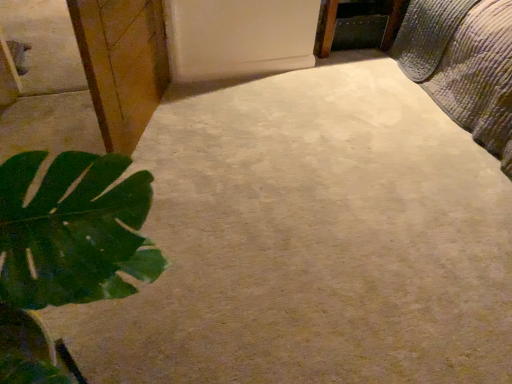
The width and height of the screenshot is (512, 384). I want to click on wooden cabinet at left, so click(122, 64).

What do you see at coordinates (464, 65) in the screenshot?
I see `textured quilted bed at upper right` at bounding box center [464, 65].

The width and height of the screenshot is (512, 384). I want to click on wooden frame at upper right, so click(x=359, y=15).

Between point (437, 64) and point (104, 1), which one is positioned behind?

The point (437, 64) is behind.

Is textured quilted bed at upper right taller or shorter than wooden cabinet at left?

textured quilted bed at upper right is shorter than wooden cabinet at left.

From the image's perspective, which one is positioned higher, textured quilted bed at upper right or wooden cabinet at left?

From the image's view, textured quilted bed at upper right is above.

How much distance is there between textured quilted bed at upper right and wooden cabinet at left?

They are 1.53 meters apart.

Where is `cabinetry in front of the wooden frame at upper right`? This screenshot has width=512, height=384. cabinetry in front of the wooden frame at upper right is located at coordinates (122, 64).

Which object is further away from the camera, wooden cabinet at left or wooden frame at upper right?

wooden frame at upper right is further away from the camera.

What's the angular difference between wooden cabinet at left and wooden frame at upper right's facing directions?

The angular difference between wooden cabinet at left and wooden frame at upper right is 70.3 degrees.

Relative to textured quilted bed at upper right, is wooden frame at upper right in front or behind?

wooden frame at upper right is positioned farther from the viewer than textured quilted bed at upper right.

Is point (377, 6) behind point (468, 10)?

That is True.

Can you confirm if wooden frame at upper right is shorter than textured quilted bed at upper right?

Correct, wooden frame at upper right is not as tall as textured quilted bed at upper right.

Considering the relative sizes of wooden cabinet at left and textured quilted bed at upper right in the image provided, is wooden cabinet at left thinner than textured quilted bed at upper right?

Correct, the width of wooden cabinet at left is less than that of textured quilted bed at upper right.

Is wooden cabinet at left bigger than textured quilted bed at upper right?

Incorrect, wooden cabinet at left is not larger than textured quilted bed at upper right.

Is wooden cabinet at left far from textured quilted bed at upper right?

Absolutely, wooden cabinet at left is distant from textured quilted bed at upper right.

In the image, is wooden cabinet at left positioned in front of or behind textured quilted bed at upper right?

Clearly, wooden cabinet at left is in front of textured quilted bed at upper right.

Visually, is textured quilted bed at upper right positioned to the left or to the right of wooden frame at upper right?

From the image, it's evident that textured quilted bed at upper right is to the right of wooden frame at upper right.

Considering the relative sizes of textured quilted bed at upper right and wooden frame at upper right in the image provided, is textured quilted bed at upper right smaller than wooden frame at upper right?

Incorrect, textured quilted bed at upper right is not smaller in size than wooden frame at upper right.

Are textured quilted bed at upper right and wooden frame at upper right located far from each other?

No, textured quilted bed at upper right is in close proximity to wooden frame at upper right.

Can we say wooden frame at upper right lies outside wooden cabinet at left?

wooden frame at upper right is positioned outside wooden cabinet at left.

Based on the photo, can you confirm if wooden frame at upper right is shorter than wooden cabinet at left?

Yes.

Is wooden frame at upper right placed right next to wooden cabinet at left?

There is a gap between wooden frame at upper right and wooden cabinet at left.

Considering the relative positions of wooden frame at upper right and wooden cabinet at left in the image provided, is wooden frame at upper right behind wooden cabinet at left?

Yes, wooden frame at upper right is further from the camera.

This screenshot has height=384, width=512. What are the coordinates of `bed on the right side of wooden cabinet at left` in the screenshot? It's located at (464, 65).

The width and height of the screenshot is (512, 384). Identify the location of furniture behind the wooden cabinet at left. (359, 15).

Based on their spatial positions, is textured quilted bed at upper right or wooden cabinet at left further from wooden frame at upper right?

wooden cabinet at left lies further to wooden frame at upper right than the other object.

From the image, which object appears to be farther from textured quilted bed at upper right, wooden cabinet at left or wooden frame at upper right?

Based on the image, wooden cabinet at left appears to be further to textured quilted bed at upper right.

From the image, which object appears to be nearer to wooden cabinet at left, wooden frame at upper right or textured quilted bed at upper right?

wooden frame at upper right.

When comparing their distances from textured quilted bed at upper right, does wooden frame at upper right or wooden cabinet at left seem closer?

wooden frame at upper right is closer to textured quilted bed at upper right.

Based on their spatial positions, is wooden cabinet at left or textured quilted bed at upper right closer to wooden frame at upper right?

textured quilted bed at upper right lies closer to wooden frame at upper right than the other object.

Which object lies further to the anchor point wooden cabinet at left, textured quilted bed at upper right or wooden frame at upper right?

textured quilted bed at upper right.

The height and width of the screenshot is (384, 512). In order to click on furniture located between wooden cabinet at left and textured quilted bed at upper right in the left-right direction in this screenshot , I will do `click(359, 15)`.